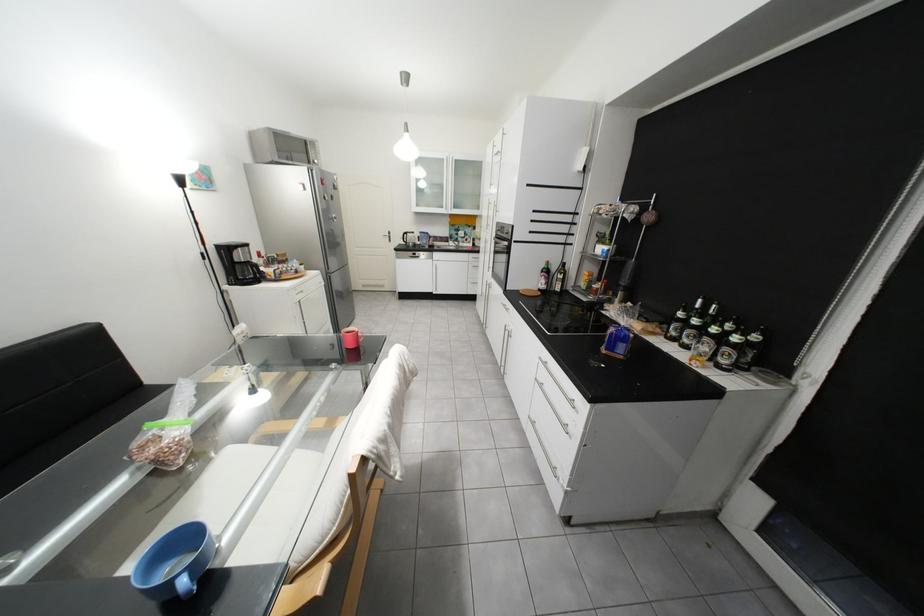
The image size is (924, 616). I want to click on pink coffee mug, so click(350, 337).